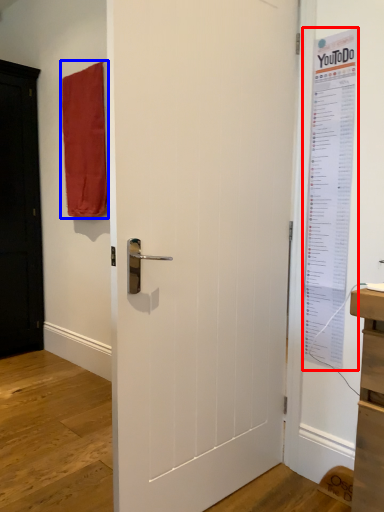
Question: Which object is closer to the camera taking this photo, poster page (highlighted by a red box) or curtain (highlighted by a blue box)?

Choices:
 (A) poster page
 (B) curtain

Answer: (A)